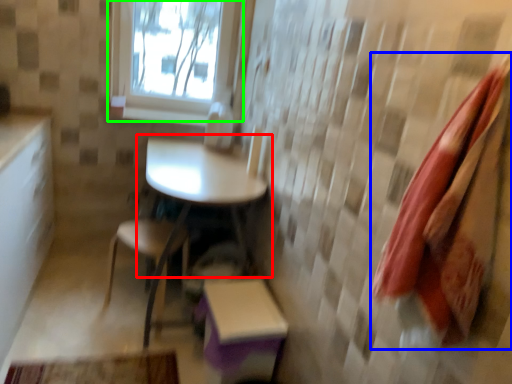
Question: Based on their relative distances, which object is nearer to table (highlighted by a red box)? Choose from beach towel (highlighted by a blue box) and window (highlighted by a green box).

Choices:
 (A) beach towel
 (B) window

Answer: (B)